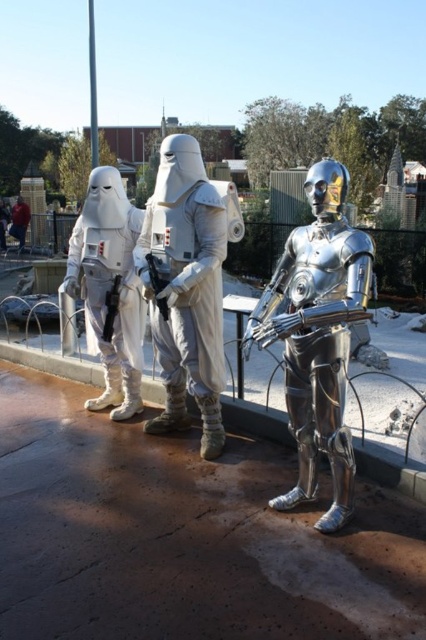
You are a photographer trying to capture a group photo of the shiny metallic robot at center and the white matte armor at center. The minimum focusing distance of your camera is 30 inches. Will you need to adjust your position to ensure both subjects are in focus?

The shiny metallic robot at center is 29.82 inches away from white matte armor at center. Since the distance between them is less than 30 inches, you will need to move closer to ensure both subjects are within the camera focusing range.